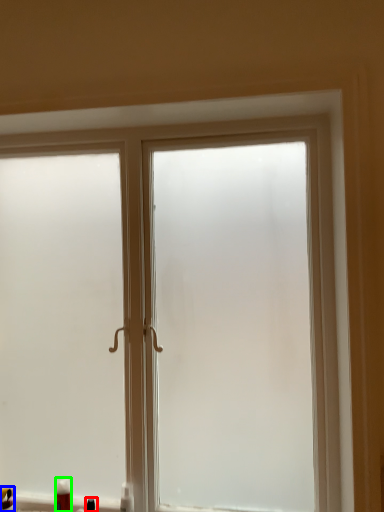
Question: Based on their relative distances, which object is nearer to toiletry (highlighted by a red box)? Choose from toiletry (highlighted by a blue box) and toiletry (highlighted by a green box).

Choices:
 (A) toiletry
 (B) toiletry

Answer: (B)